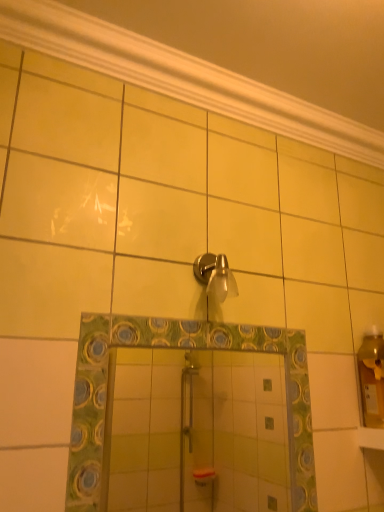
Question: Is satin nickel shower head at upper center aimed at green mosaic mirror at center?

Choices:
 (A) yes
 (B) no

Answer: (B)

Question: Is the position of satin nickel shower head at upper center more distant than that of green mosaic mirror at center?

Choices:
 (A) no
 (B) yes

Answer: (B)

Question: Is satin nickel shower head at upper center turned away from green mosaic mirror at center?

Choices:
 (A) yes
 (B) no

Answer: (B)

Question: Can you confirm if satin nickel shower head at upper center is shorter than green mosaic mirror at center?

Choices:
 (A) no
 (B) yes

Answer: (B)

Question: Considering the relative positions of satin nickel shower head at upper center and green mosaic mirror at center in the image provided, is satin nickel shower head at upper center to the right of green mosaic mirror at center from the viewer's perspective?

Choices:
 (A) no
 (B) yes

Answer: (B)

Question: Based on their positions, is white glossy molding at upper center located to the left or right of green mosaic mirror at center?

Choices:
 (A) left
 (B) right

Answer: (B)

Question: In terms of height, does white glossy molding at upper center look taller or shorter compared to green mosaic mirror at center?

Choices:
 (A) short
 (B) tall

Answer: (A)

Question: From the image's perspective, is white glossy molding at upper center above or below green mosaic mirror at center?

Choices:
 (A) below
 (B) above

Answer: (B)

Question: Considering the positions of white glossy molding at upper center and green mosaic mirror at center in the image, is white glossy molding at upper center wider or thinner than green mosaic mirror at center?

Choices:
 (A) thin
 (B) wide

Answer: (B)

Question: From a real-world perspective, relative to white glossy molding at upper center, is satin nickel shower head at upper center vertically above or below?

Choices:
 (A) above
 (B) below

Answer: (B)

Question: Is satin nickel shower head at upper center taller or shorter than white glossy molding at upper center?

Choices:
 (A) short
 (B) tall

Answer: (B)

Question: Is satin nickel shower head at upper center spatially inside white glossy molding at upper center, or outside of it?

Choices:
 (A) inside
 (B) outside

Answer: (B)

Question: In the image, is satin nickel shower head at upper center positioned in front of or behind white glossy molding at upper center?

Choices:
 (A) behind
 (B) front

Answer: (A)

Question: In terms of width, does green mosaic mirror at center look wider or thinner when compared to white glossy molding at upper center?

Choices:
 (A) wide
 (B) thin

Answer: (B)

Question: From a real-world perspective, is green mosaic mirror at center above or below white glossy molding at upper center?

Choices:
 (A) below
 (B) above

Answer: (A)